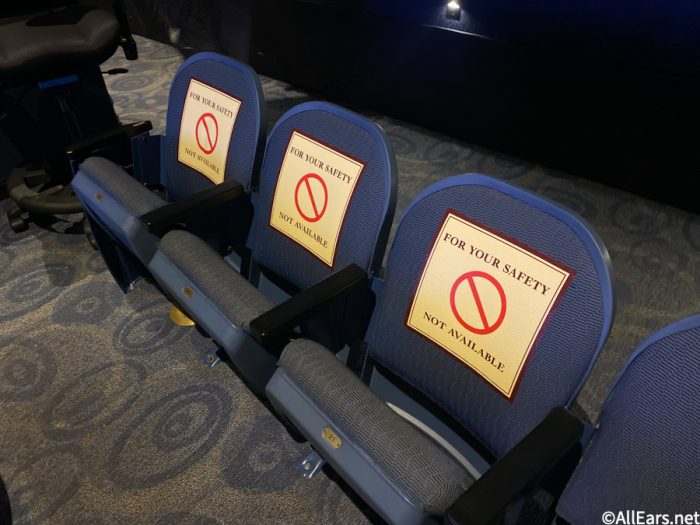
Find the location of `seat`. seat is located at coordinates (113, 215).